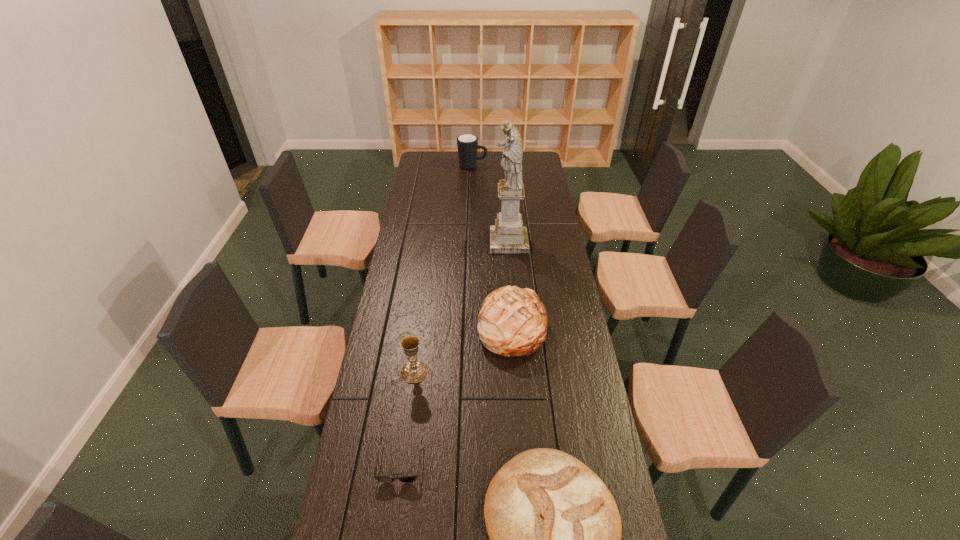
This screenshot has height=540, width=960. Find the location of `vacant space located on the side of the farthest object with the handle`. vacant space located on the side of the farthest object with the handle is located at coordinates (539, 166).

You are a GUI agent. You are given a task and a screenshot of the screen. Output one action in this format:
    pyautogui.click(x=<x>, y=<y>)
    Task: Click on the vacant space located on the back of the farther bread
    Image resolution: width=960 pixels, height=540 pixels.
    Given the screenshot: What is the action you would take?
    pyautogui.click(x=509, y=288)

This screenshot has height=540, width=960. In order to click on vacant space positioned on the front of the fourth farthest object in this screenshot , I will do `click(399, 485)`.

Locate an element on the screen. The image size is (960, 540). vacant space located on the front lenses of the shortest object is located at coordinates (393, 518).

You are a GUI agent. You are given a task and a screenshot of the screen. Output one action in this format:
    pyautogui.click(x=<x>, y=<y>)
    Task: Click on the object present at the far edge
    This screenshot has height=540, width=960.
    Given the screenshot: What is the action you would take?
    pyautogui.click(x=467, y=144)

Where is `chalice that is at the left edge`? This screenshot has height=540, width=960. chalice that is at the left edge is located at coordinates (413, 371).

This screenshot has height=540, width=960. Find the location of `sunglasses present at the left edge`. sunglasses present at the left edge is located at coordinates (384, 479).

Image resolution: width=960 pixels, height=540 pixels. What are the coordinates of `sculpture that is at the right edge` in the screenshot? It's located at (508, 236).

Locate an element on the screen. bread that is positioned at the right edge is located at coordinates (512, 322).

The height and width of the screenshot is (540, 960). I want to click on vacant space at the far edge of the desktop, so click(454, 168).